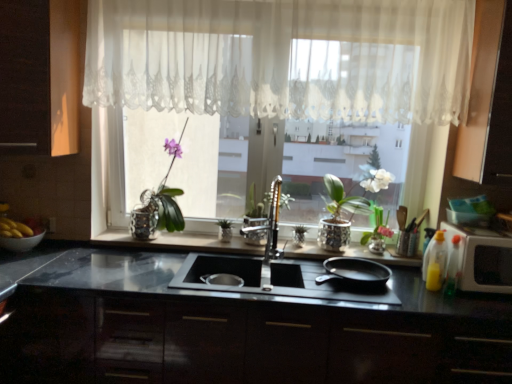
Question: Relative to black glossy cabinetry at center, marked as the second cabinetry in a right-to-left arrangement, is black matte frying pan at right in front or behind?

Choices:
 (A) front
 (B) behind

Answer: (B)

Question: Would you say black matte frying pan at right is to the left or to the right of black glossy cabinetry at center, which is the 3th cabinetry from top to bottom, in the picture?

Choices:
 (A) left
 (B) right

Answer: (B)

Question: Based on their relative distances, which object is farther from the white glossy microwave at right?

Choices:
 (A) yellow matte bananas at left
 (B) pink glass vase at center
 (C) white lace curtain at upper center
 (D) matte white bowl at left, which is the first glass bowl in left-to-right order
 (E) dark wood cabinet at left, the third cabinetry from the bottom

Answer: (A)

Question: Which object is the farthest from the white glossy microwave at right?

Choices:
 (A) matte wood cabinet at upper right, which appears as the 2th cabinetry when viewed from the top
 (B) polished chrome faucet at center
 (C) white glossy pot at center
 (D) yellow translucent bottle at right, which is the 2th bottle in left-to-right order
 (E) transparent glass bowl at right, arranged as the first glass bowl when viewed from the top

Answer: (B)